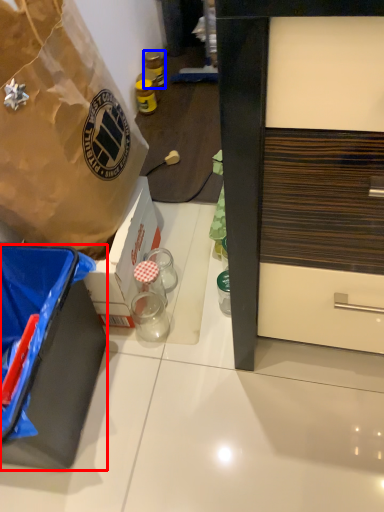
Question: Which of the following is the closest to the observer, box (highlighted by a red box) or bottle (highlighted by a blue box)?

Choices:
 (A) box
 (B) bottle

Answer: (A)